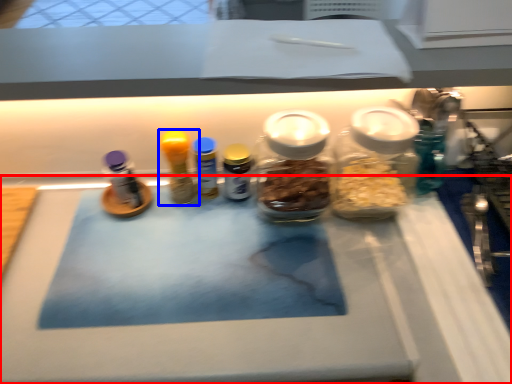
Question: Which object appears farthest to the camera in this image, table (highlighted by a red box) or bottle (highlighted by a blue box)?

Choices:
 (A) table
 (B) bottle

Answer: (B)